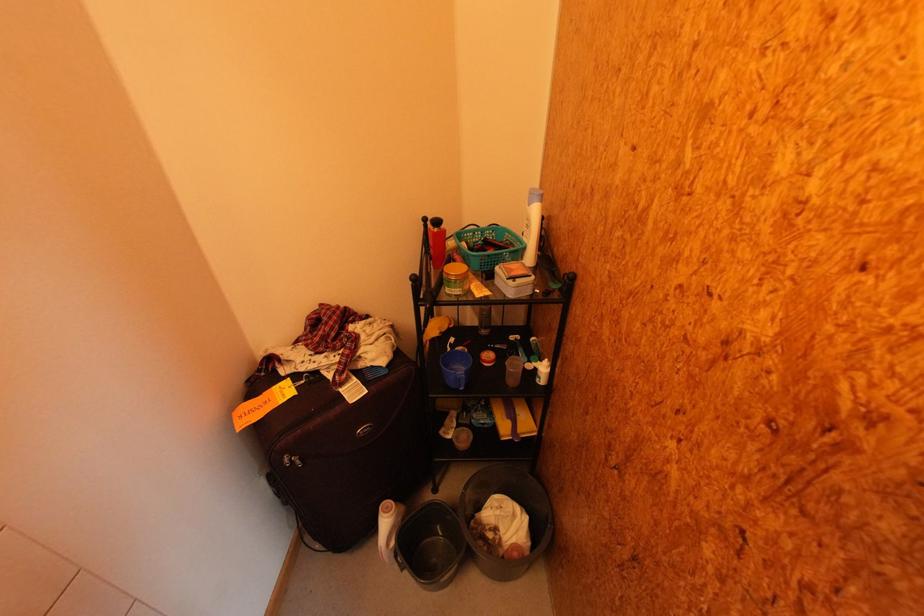
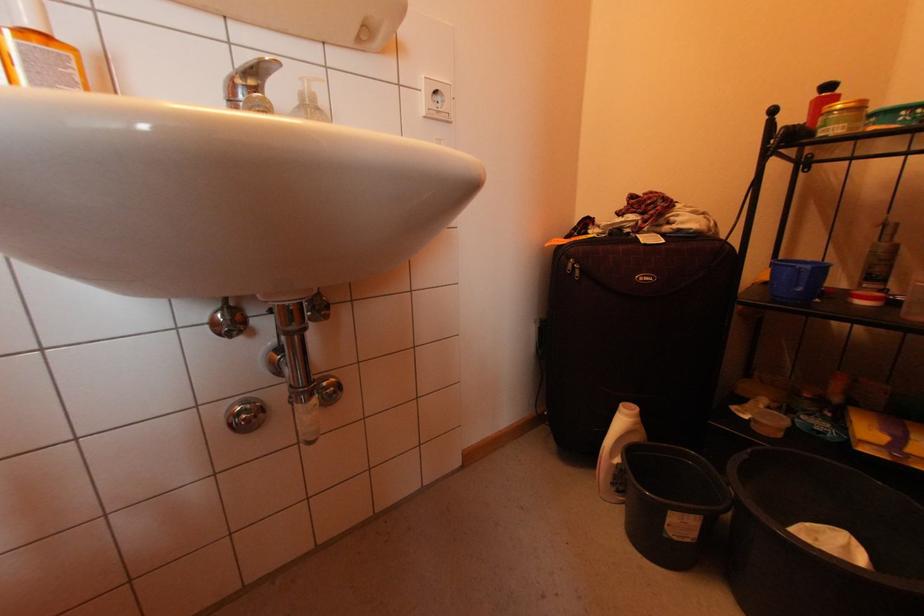
Question: How did the camera likely rotate?

Choices:
 (A) Left
 (B) Right
 (C) Up
 (D) Down

Answer: (A)